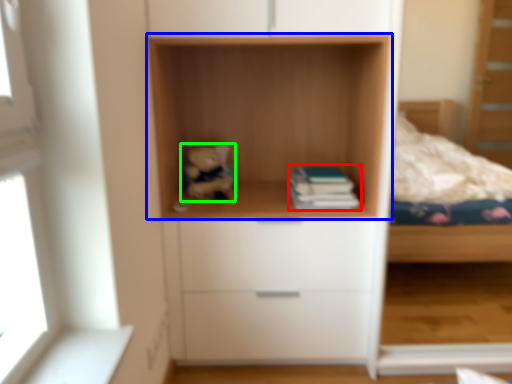
Question: Estimate the real-world distances between objects in this image. Which object is closer to paperback book (highlighted by a red box), shelf (highlighted by a blue box) or toy (highlighted by a green box)?

Choices:
 (A) shelf
 (B) toy

Answer: (A)